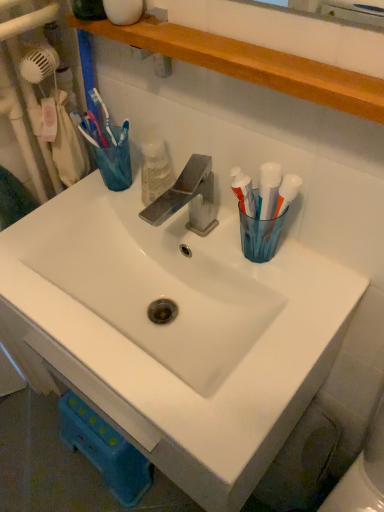
Locate an element on the screen. free space on the front side of translucent plastic toothbrush at upper left is located at coordinates (77, 210).